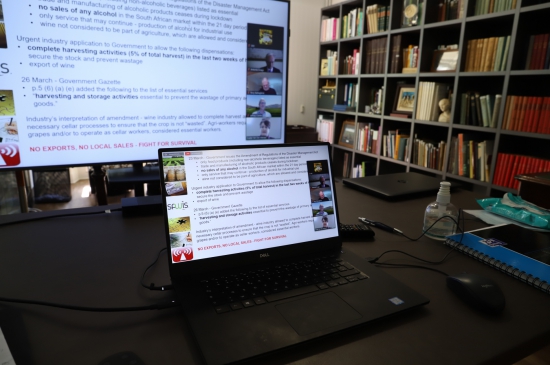
Find the location of a particular element. wall is located at coordinates (312, 49).